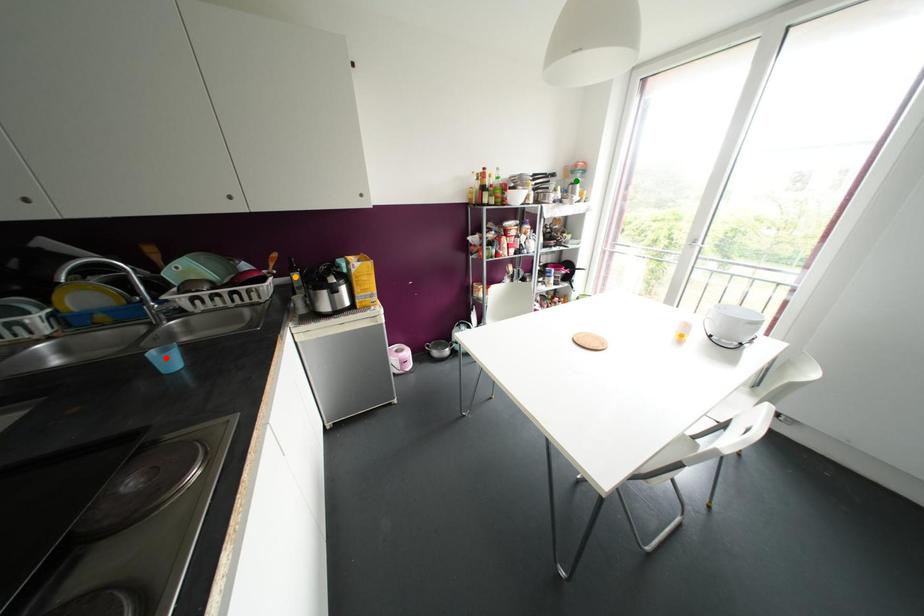
Order these from nearest to farthest:
green point
orange point
red point

red point → orange point → green point